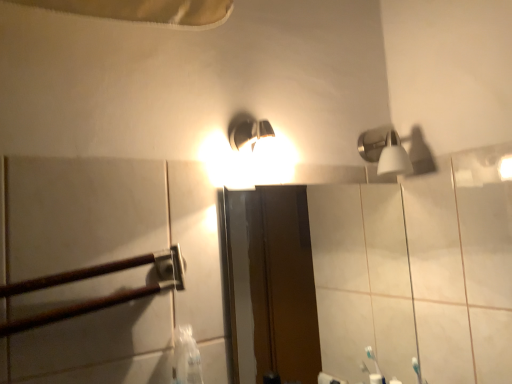
Describe the element at coordinates (99, 297) in the screenshot. This screenshot has width=512, height=384. I see `brown wooden rail at left` at that location.

This screenshot has height=384, width=512. What do you see at coordinates (418, 271) in the screenshot?
I see `matte glass mirror at center` at bounding box center [418, 271].

In order to face matte glass mirror at center, should I rotate leftwards or rightwards?

To face it directly, rotate right by 9.706 degrees.

Identify the location of satin nickel shower head at upper right. (385, 151).

From a real-world perspective, which is physically above, brown wooden rail at left or satin nickel shower head at upper right?

From a 3D spatial view, satin nickel shower head at upper right is above.

From the image's perspective, between brown wooden rail at left and satin nickel shower head at upper right, who is located below?

brown wooden rail at left is shown below in the image.

From the image's perspective, is matte glass mirror at center on top of satin nickel shower head at upper right?

No, from the image's perspective, matte glass mirror at center is not over satin nickel shower head at upper right.

Is matte glass mirror at center beside satin nickel shower head at upper right?

They are not placed beside each other.

Which of these two, matte glass mirror at center or satin nickel shower head at upper right, is smaller?

With smaller size is satin nickel shower head at upper right.

Does matte glass mirror at center have a lesser height compared to satin nickel shower head at upper right?

In fact, matte glass mirror at center may be taller than satin nickel shower head at upper right.

Is brown wooden rail at left aimed at matte glass mirror at center?

No, brown wooden rail at left is not aimed at matte glass mirror at center.

Can you tell me how much brown wooden rail at left and matte glass mirror at center differ in facing direction?

The facing directions of brown wooden rail at left and matte glass mirror at center are 3.62 degrees apart.

Which is closer, (29, 288) or (393, 306)?

The point (29, 288) is closer.

Between brown wooden rail at left and matte glass mirror at center, which one appears on the right side from the viewer's perspective?

Positioned to the right is matte glass mirror at center.

Is satin nickel shower head at upper right positioned in front of brown wooden rail at left?

No.

Could you tell me if satin nickel shower head at upper right is turned towards brown wooden rail at left?

No.

Between satin nickel shower head at upper right and brown wooden rail at left, which one appears on the right side from the viewer's perspective?

Positioned to the right is satin nickel shower head at upper right.

From a real-world perspective, is satin nickel shower head at upper right over brown wooden rail at left?

Yes, from a real-world perspective, satin nickel shower head at upper right is above brown wooden rail at left.

Can you see matte glass mirror at center touching brown wooden rail at left?

matte glass mirror at center and brown wooden rail at left are clearly separated.

At what (x,y) coordinates should I click in order to perform the action: click on mirror below the brown wooden rail at left (from a real-world perspective). Please return your answer as a coordinate pair (x, y). Looking at the image, I should click on (418, 271).

In terms of size, does matte glass mirror at center appear bigger or smaller than brown wooden rail at left?

matte glass mirror at center is bigger than brown wooden rail at left.

From a real-world perspective, which is physically above, matte glass mirror at center or brown wooden rail at left?

brown wooden rail at left is physically above.

From the image's perspective, between satin nickel shower head at upper right and matte glass mirror at center, which one is located above?

satin nickel shower head at upper right, from the image's perspective.

Does satin nickel shower head at upper right turn towards matte glass mirror at center?

No.

Is satin nickel shower head at upper right further to camera compared to matte glass mirror at center?

Yes.

Considering the sizes of objects satin nickel shower head at upper right and matte glass mirror at center in the image provided, who is thinner, satin nickel shower head at upper right or matte glass mirror at center?

matte glass mirror at center.

Where is `rail located underneath the satin nickel shower head at upper right (from a real-world perspective)`? This screenshot has height=384, width=512. rail located underneath the satin nickel shower head at upper right (from a real-world perspective) is located at coordinates (99, 297).

What are the coordinates of `shower positioned vertically above the matte glass mirror at center (from a real-world perspective)` in the screenshot? It's located at (385, 151).

Looking at the image, which one is located further to satin nickel shower head at upper right, matte glass mirror at center or brown wooden rail at left?

The object further to satin nickel shower head at upper right is brown wooden rail at left.

Looking at the image, which one is located further to matte glass mirror at center, satin nickel shower head at upper right or brown wooden rail at left?

brown wooden rail at left.

When comparing their distances from matte glass mirror at center, does brown wooden rail at left or satin nickel shower head at upper right seem closer?

The object closer to matte glass mirror at center is satin nickel shower head at upper right.

Estimate the real-world distances between objects in this image. Which object is closer to satin nickel shower head at upper right, brown wooden rail at left or matte glass mirror at center?

The object closer to satin nickel shower head at upper right is matte glass mirror at center.

Looking at the image, which one is located closer to brown wooden rail at left, satin nickel shower head at upper right or matte glass mirror at center?

satin nickel shower head at upper right lies closer to brown wooden rail at left than the other object.

Looking at the image, which one is located closer to brown wooden rail at left, matte glass mirror at center or satin nickel shower head at upper right?

satin nickel shower head at upper right lies closer to brown wooden rail at left than the other object.

This screenshot has height=384, width=512. I want to click on mirror located between brown wooden rail at left and satin nickel shower head at upper right in the left-right direction, so click(418, 271).